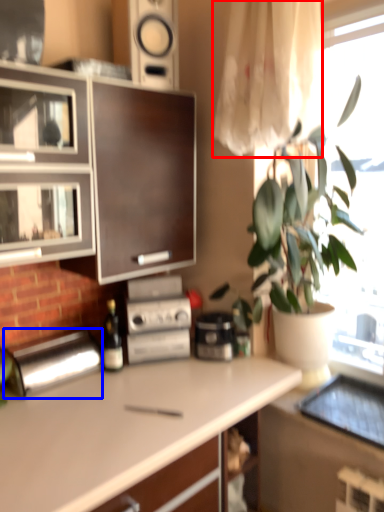
Question: Among these objects, which one is farthest to the camera, curtain (highlighted by a red box) or appliance (highlighted by a blue box)?

Choices:
 (A) curtain
 (B) appliance

Answer: (B)